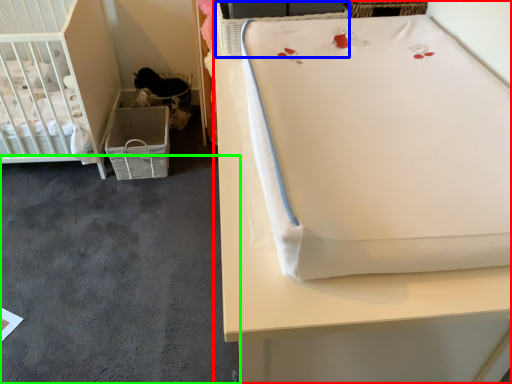
Question: Which object is positioned closest to furniture (highlighted by a red box)? Select from basket (highlighted by a blue box) and concrete (highlighted by a green box).

Choices:
 (A) basket
 (B) concrete

Answer: (A)